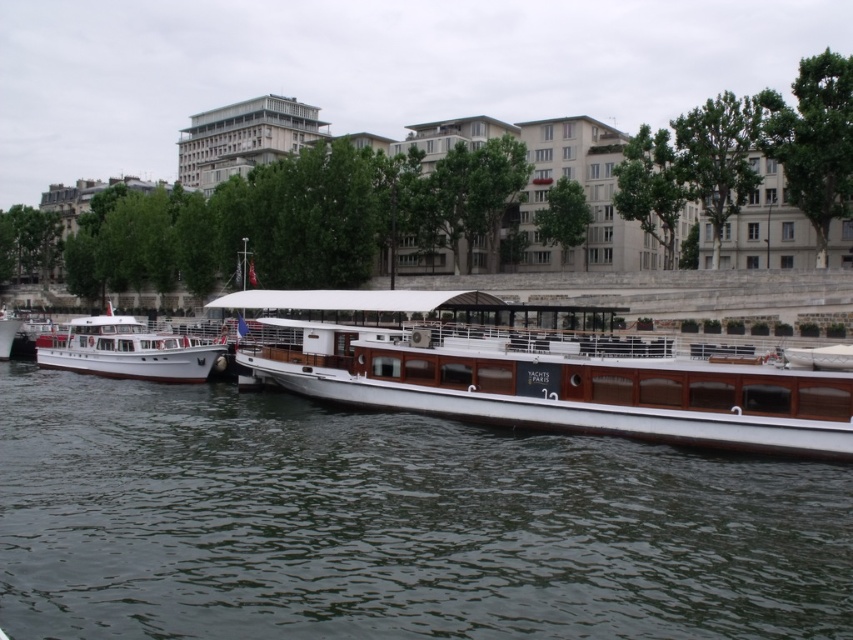
You are standing on the riverbank and see two points marked on the boats. Which point, point (556, 470) or point (498, 412), is closer to you?

Point (556, 470) is in front of point (498, 412), so it is closer to you.

You are standing at the riverside and want to reach a specific point marked at coordinates point (328,506). If your maximum comfortable walking distance is 40 meters, can you comfortably walk to that point from your current position?

The distance of point (328,506) from camera is 41.41 meters, which exceeds your maximum comfortable walking distance of 40 meters. Therefore, you cannot comfortably walk to that point.